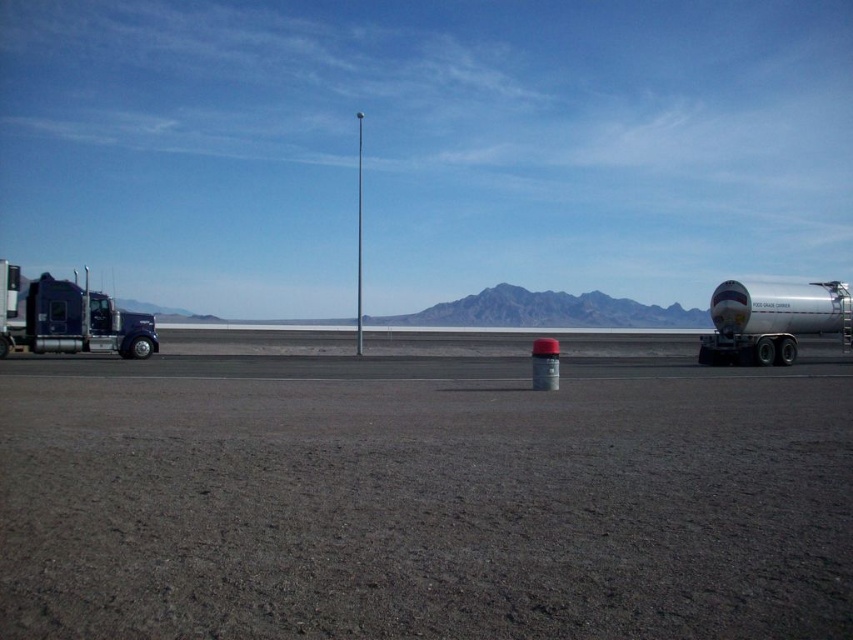
You are a delivery driver who needs to park your truck on the gray asphalt tarmac at center. However, there is a silver metallic tanker at right nearby. Based on the scene description, can you safely park your truck on the tarmac without blocking the tanker?

The gray asphalt tarmac at center is positioned under the silver metallic tanker at right, which means the tanker is directly above the tarmac. Therefore, parking your truck there would block the tanker from moving freely. Choose an alternative parking spot.